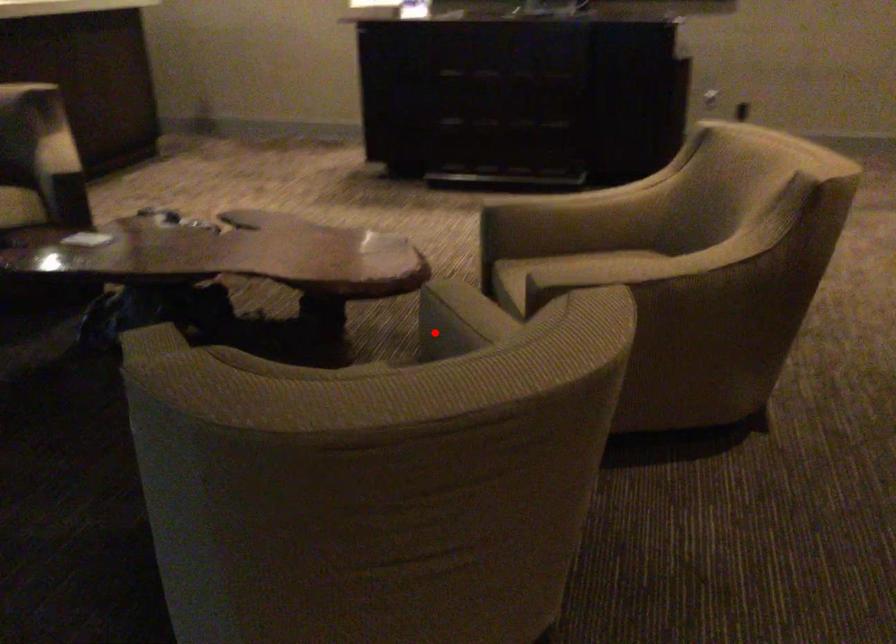
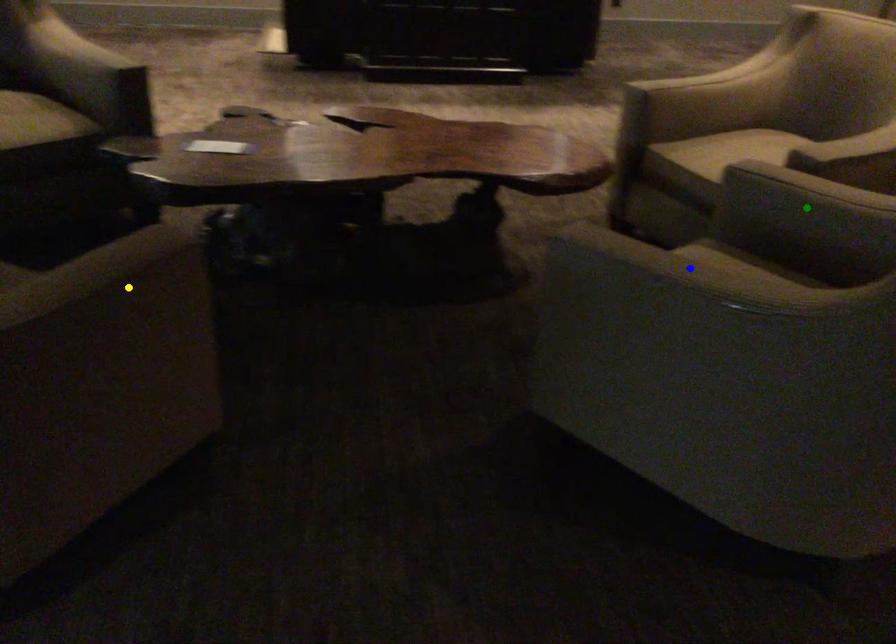
Question: I am providing you with two images of the same scene from different viewpoints. A red point is marked on the first image. You are given multiple points on the second image. Can you choose the point in image 2 that corresponds to the point in image 1?

Choices:
 (A) yellow point
 (B) green point
 (C) blue point

Answer: (B)